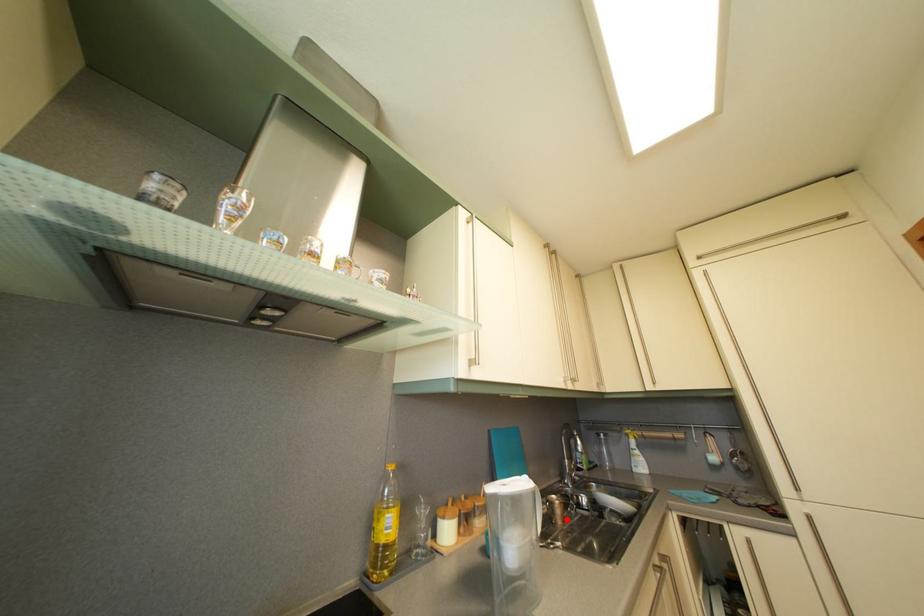
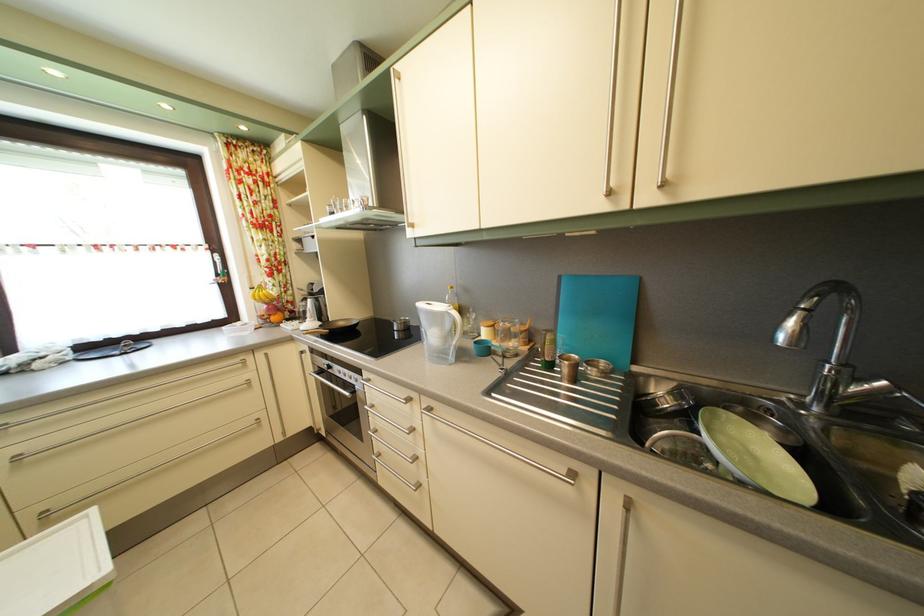
Locate, in the second image, the point that corresponds to the highlighted location in the first image.

(574, 378)